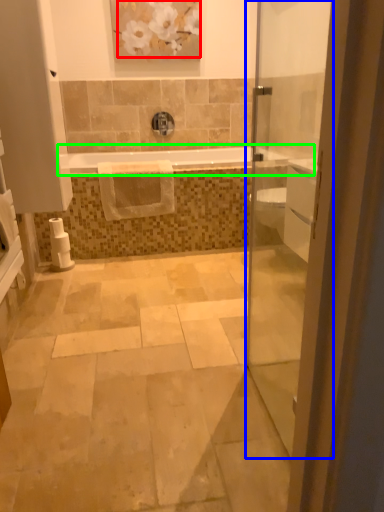
Question: Which is nearer to the flower (highlighted by a red box)? door (highlighted by a blue box) or bathtub (highlighted by a green box).

Choices:
 (A) door
 (B) bathtub

Answer: (A)